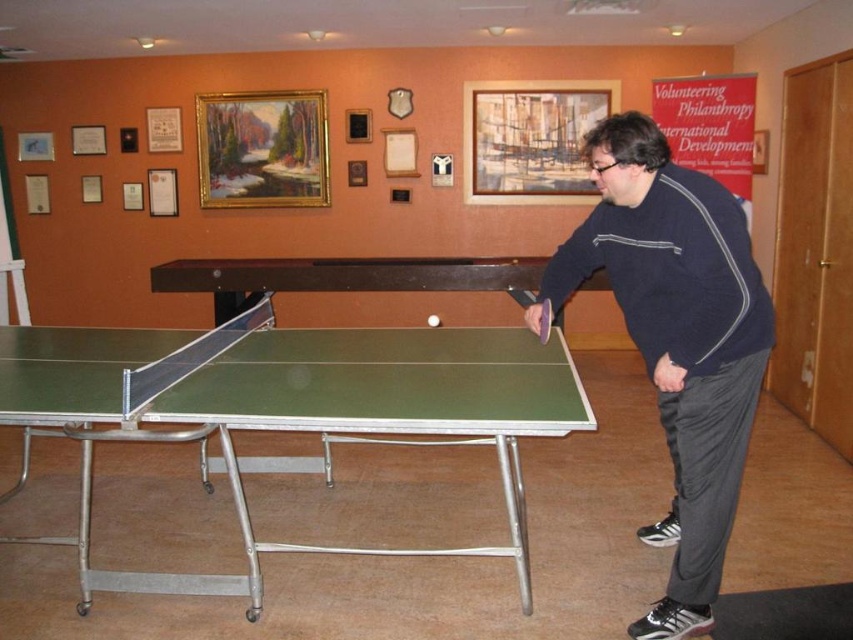
You are standing at the center of the room and want to reach the dark blue sweater at right. Which direction should you move to get there?

You should move to your right because the dark blue sweater at right is located to the right side of the room.

You are standing in the room where the table tennis game is happening. You want to pass through the area between the dark blue sweater at right and the green rubber table at center to reach the door on the other side. Is there enough space for you to walk through?

The dark blue sweater at right is behind the green rubber table at center, so there is no space between them for you to walk through. You will need to go around either side of the green rubber table at center instead.